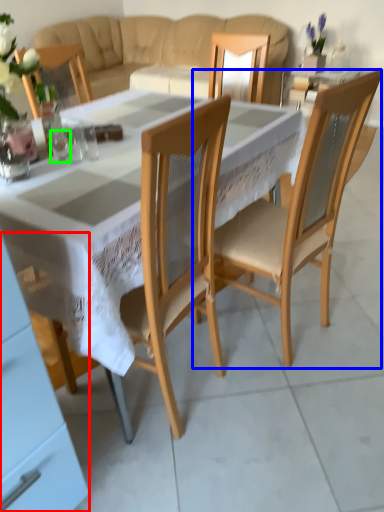
Question: Which is nearer to the cabinetry (highlighted by a red box)? chair (highlighted by a blue box) or tableware (highlighted by a green box).

Choices:
 (A) chair
 (B) tableware

Answer: (B)